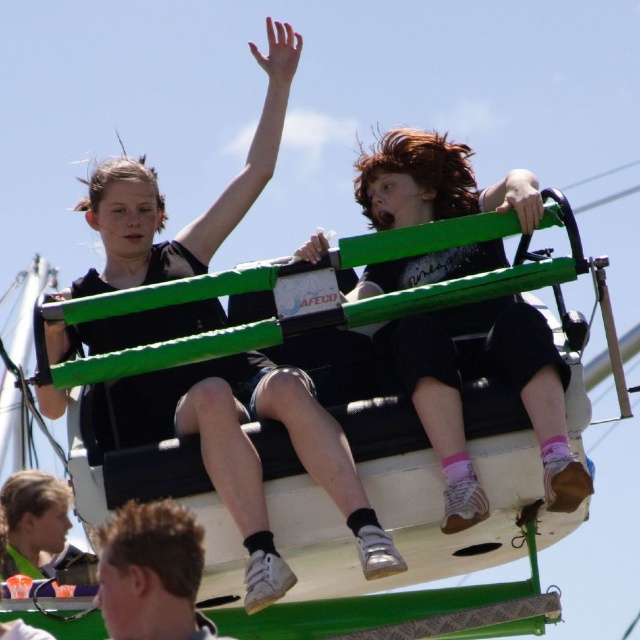
You are standing in front of the amusement ride and want to determine which of the two points, point (336, 621) or point (216, 227), is nearer to you. Based on the scene, which point is closer?

Point (336, 621) is closer to the camera than point (216, 227), so it is the nearer one.

You are an amusement park safety inspector checking the green painted metal amusement ride at center and the matte black shorts at center. According to the safety guidelines, the ride must be at least 1.5 times wider than any clothing item attached to it. Can you confirm if the ride meets this requirement?

The green painted metal amusement ride at center might be wider than matte black shorts at center, but the exact width comparison is uncertain. Without precise measurements, it is not possible to confirm if the ride meets the safety guideline requirement of being at least 1.5 times wider than the matte black shorts at center.